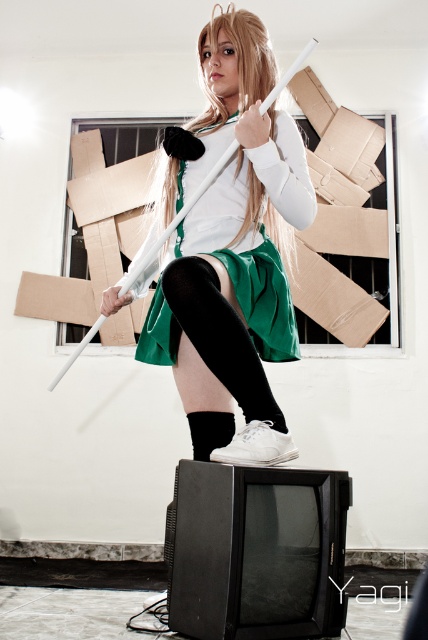
Is matte white sword at center positioned at the back of green fabric skirt at center?

That is False.

In the scene shown: Does matte white sword at center have a lesser height compared to green fabric skirt at center?

No, matte white sword at center is not shorter than green fabric skirt at center.

This screenshot has width=428, height=640. I want to click on matte white sword at center, so click(229, 252).